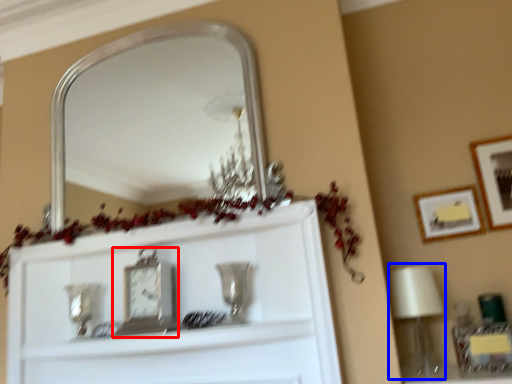
Question: Which object appears closest to the camera in this image, clock (highlighted by a red box) or lamp (highlighted by a blue box)?

Choices:
 (A) clock
 (B) lamp

Answer: (A)